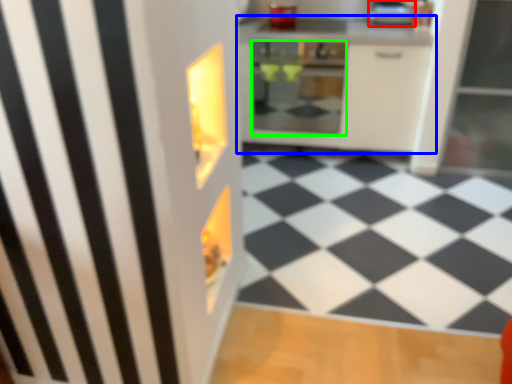
Question: Based on their relative distances, which object is nearer to appliance (highlighted by a red box)? Choose from cabinetry (highlighted by a blue box) and oven (highlighted by a green box).

Choices:
 (A) cabinetry
 (B) oven

Answer: (A)